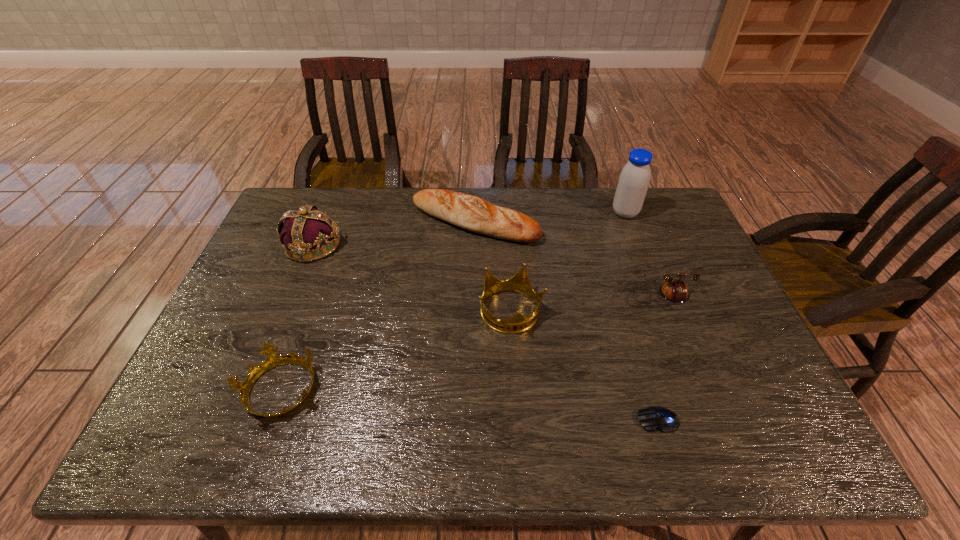
Locate an element on the screen. This screenshot has width=960, height=540. free point that satisfies the following two spatial constraints: 1. on the rotary dial of the telephone; 2. on the button side of the shortest object is located at coordinates (708, 420).